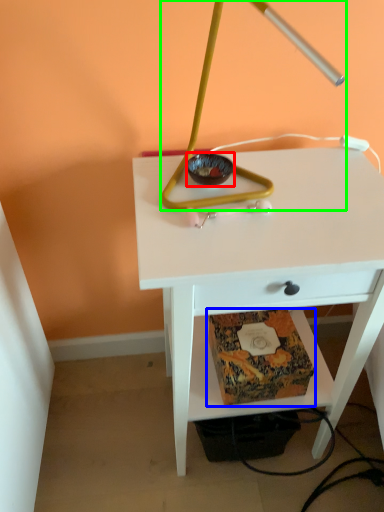
Question: Which object is positioned closest to glass bowl (highlighted by a red box)? Select from paperback book (highlighted by a blue box) and lamp (highlighted by a green box).

Choices:
 (A) paperback book
 (B) lamp

Answer: (B)